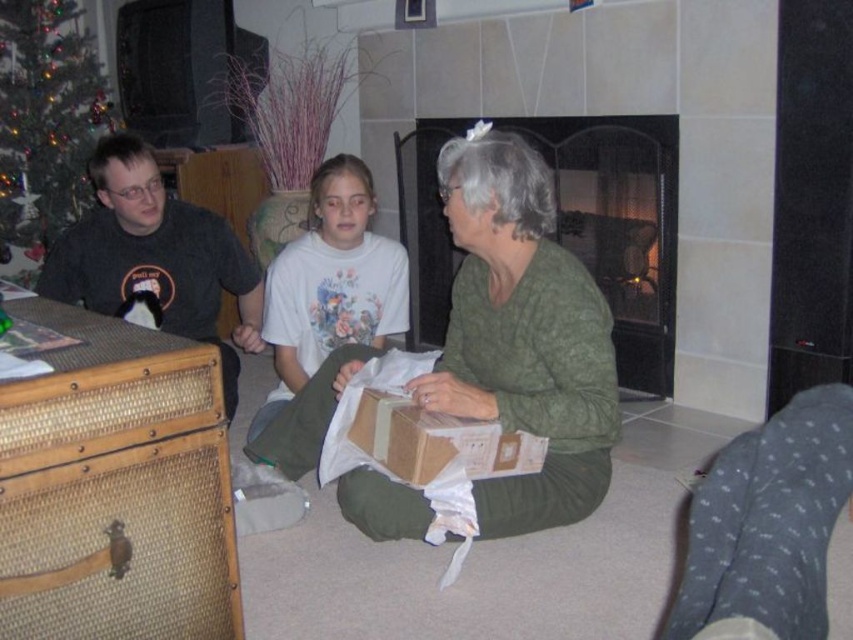
Describe the element at coordinates (45, 124) in the screenshot. The height and width of the screenshot is (640, 853). I see `green matte christmas tree at left` at that location.

Locate an element on the screen. The height and width of the screenshot is (640, 853). green matte christmas tree at left is located at coordinates (45, 124).

Can you confirm if green fabric fireplace at center is thinner than matte black shirt at left?

Incorrect, green fabric fireplace at center's width is not less than matte black shirt at left's.

Can you confirm if green fabric fireplace at center is wider than matte black shirt at left?

Indeed, green fabric fireplace at center has a greater width compared to matte black shirt at left.

Find the location of `green fabric fireplace at center`. green fabric fireplace at center is located at coordinates (619, 225).

You are a GUI agent. You are given a task and a screenshot of the screen. Output one action in this format:
    pyautogui.click(x=<x>, y=<y>)
    Task: Click on the green fabric fireplace at center
    This screenshot has width=853, height=640.
    Given the screenshot: What is the action you would take?
    pyautogui.click(x=619, y=225)

Is green fabric fireplace at center to the right of white cotton shirt at center from the viewer's perspective?

Correct, you'll find green fabric fireplace at center to the right of white cotton shirt at center.

Locate an element on the screen. Image resolution: width=853 pixels, height=640 pixels. green fabric fireplace at center is located at coordinates (619, 225).

At what (x,y) coordinates should I click in order to perform the action: click on green fabric fireplace at center. Please return your answer as a coordinate pair (x, y). The height and width of the screenshot is (640, 853). Looking at the image, I should click on (619, 225).